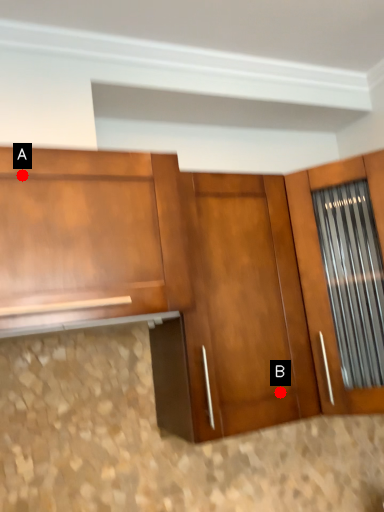
Question: Two points are circled on the image, labeled by A and B beside each circle. Which of the following is the farthest from the observer?

Choices:
 (A) A is further
 (B) B is further

Answer: (B)